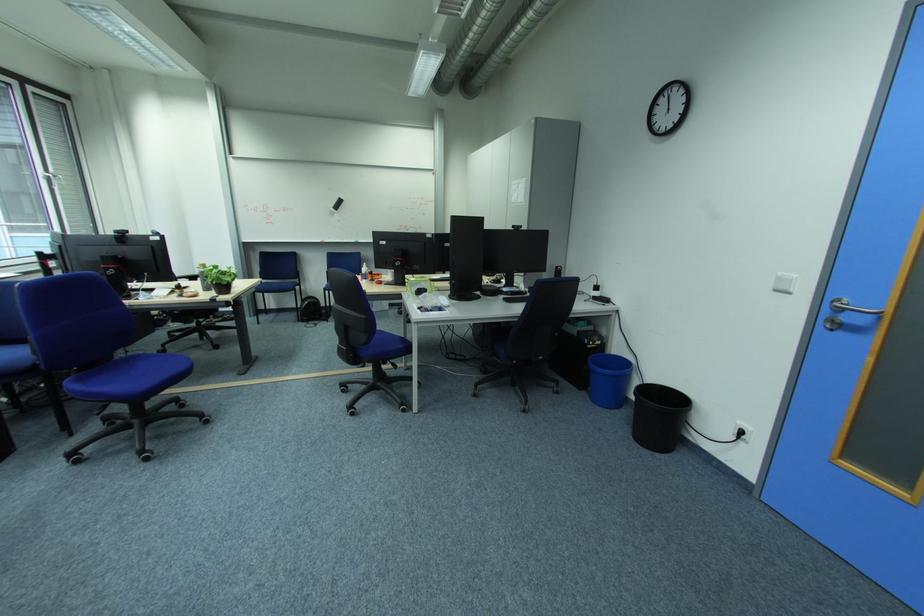
Image resolution: width=924 pixels, height=616 pixels. What do you see at coordinates (336, 204) in the screenshot?
I see `the black webcam` at bounding box center [336, 204].